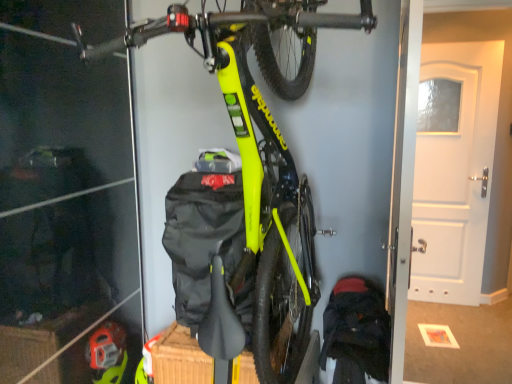
Question: Is neon yellow matte bicycle at center bigger than white matte door at upper right?

Choices:
 (A) no
 (B) yes

Answer: (B)

Question: Is neon yellow matte bicycle at center not close to white matte door at upper right?

Choices:
 (A) yes
 (B) no

Answer: (A)

Question: Can you confirm if neon yellow matte bicycle at center is thinner than white matte door at upper right?

Choices:
 (A) no
 (B) yes

Answer: (A)

Question: Can we say neon yellow matte bicycle at center lies outside white matte door at upper right?

Choices:
 (A) yes
 (B) no

Answer: (A)

Question: Is neon yellow matte bicycle at center in contact with white matte door at upper right?

Choices:
 (A) no
 (B) yes

Answer: (A)

Question: From the image's perspective, would you say neon yellow matte bicycle at center is shown under white matte door at upper right?

Choices:
 (A) no
 (B) yes

Answer: (A)

Question: Are dark blue fabric backpack at lower right and neon yellow matte bicycle at center making contact?

Choices:
 (A) yes
 (B) no

Answer: (B)

Question: Considering the relative sizes of dark blue fabric backpack at lower right and neon yellow matte bicycle at center in the image provided, is dark blue fabric backpack at lower right taller than neon yellow matte bicycle at center?

Choices:
 (A) yes
 (B) no

Answer: (B)

Question: Can you confirm if dark blue fabric backpack at lower right is wider than neon yellow matte bicycle at center?

Choices:
 (A) no
 (B) yes

Answer: (A)

Question: From a real-world perspective, is dark blue fabric backpack at lower right located beneath neon yellow matte bicycle at center?

Choices:
 (A) no
 (B) yes

Answer: (B)

Question: Is dark blue fabric backpack at lower right not inside neon yellow matte bicycle at center?

Choices:
 (A) no
 (B) yes

Answer: (A)

Question: Is dark blue fabric backpack at lower right bigger than neon yellow matte bicycle at center?

Choices:
 (A) no
 (B) yes

Answer: (A)

Question: Does white matte door at upper right have a greater height compared to neon yellow matte bicycle at center?

Choices:
 (A) yes
 (B) no

Answer: (A)